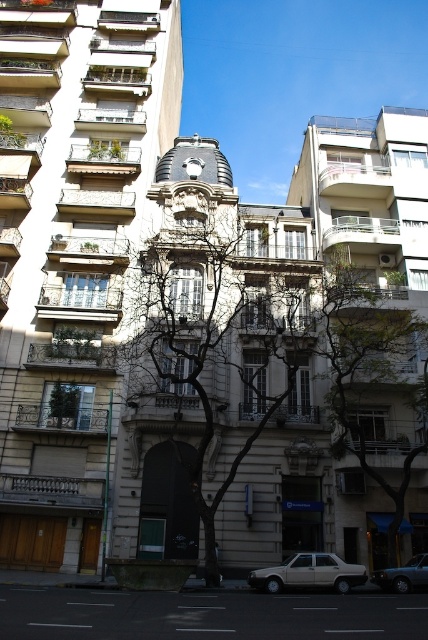
Is green leafy tree at center bigger than beige matte sedan at lower center?

Yes, green leafy tree at center is bigger than beige matte sedan at lower center.

Can you confirm if green leafy tree at center is positioned to the right of beige matte sedan at lower center?

Indeed, green leafy tree at center is positioned on the right side of beige matte sedan at lower center.

Is point (410, 429) closer to camera compared to point (350, 582)?

No, it is not.

Locate an element on the screen. green leafy tree at center is located at coordinates (371, 376).

In the scene shown: Is green leafy tree at center above silver metallic sedan at center?

Yes.

Where is `green leafy tree at center`? green leafy tree at center is located at coordinates (371, 376).

Identify the location of green leafy tree at center. Image resolution: width=428 pixels, height=640 pixels. (371, 376).

Identify the location of green leafy tree at center. (371, 376).

Between bare branches at center and beige matte sedan at lower center, which one is positioned lower?

beige matte sedan at lower center is below.

Which is above, bare branches at center or beige matte sedan at lower center?

Positioned higher is bare branches at center.

Is point (225, 413) less distant than point (293, 572)?

That is False.

Locate an element on the screen. The image size is (428, 640). bare branches at center is located at coordinates (210, 346).